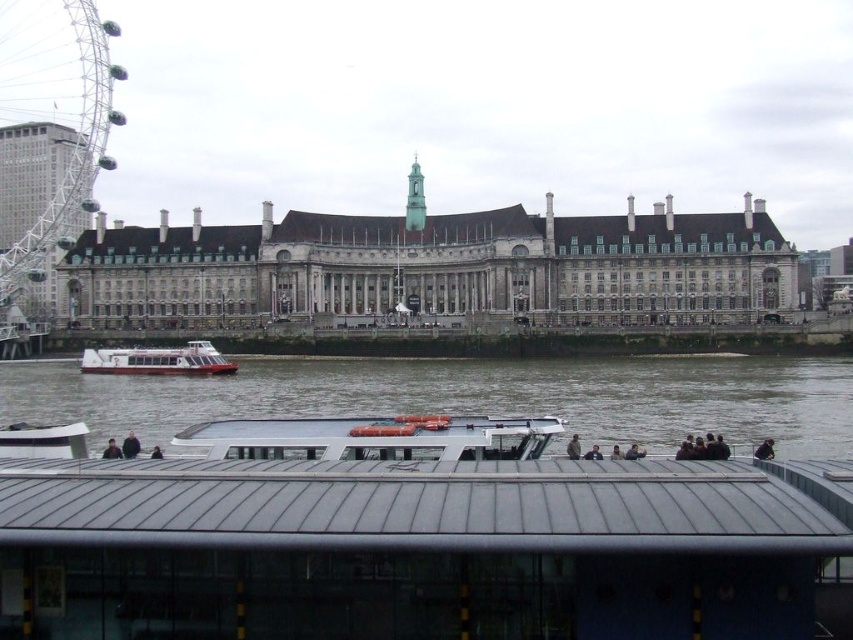
You are a photographer planning to capture a wide shot of the waterfront scene. Given that the gray stone building at center and the brown water at lower center are both in your frame, which object should you focus on to ensure the most impactful composition, and why?

The gray stone building at center is bigger than the brown water at lower center, so focusing on the gray stone building at center would create a more impactful composition due to its larger size dominating the scene.

You are a photographer planning to capture the gray stone building at center and the metallic ferris wheel at left in the same frame. Based on their positions, which one would appear lower in the photo?

The gray stone building at center appears lower in the photo because it is positioned below the metallic ferris wheel at left.